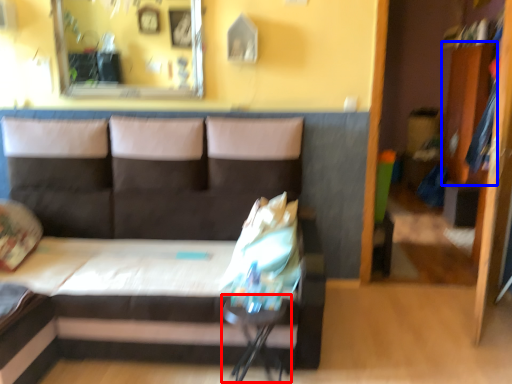
Question: Which of the following is the farthest to the observer, table (highlighted by a red box) or dresser (highlighted by a blue box)?

Choices:
 (A) table
 (B) dresser

Answer: (B)